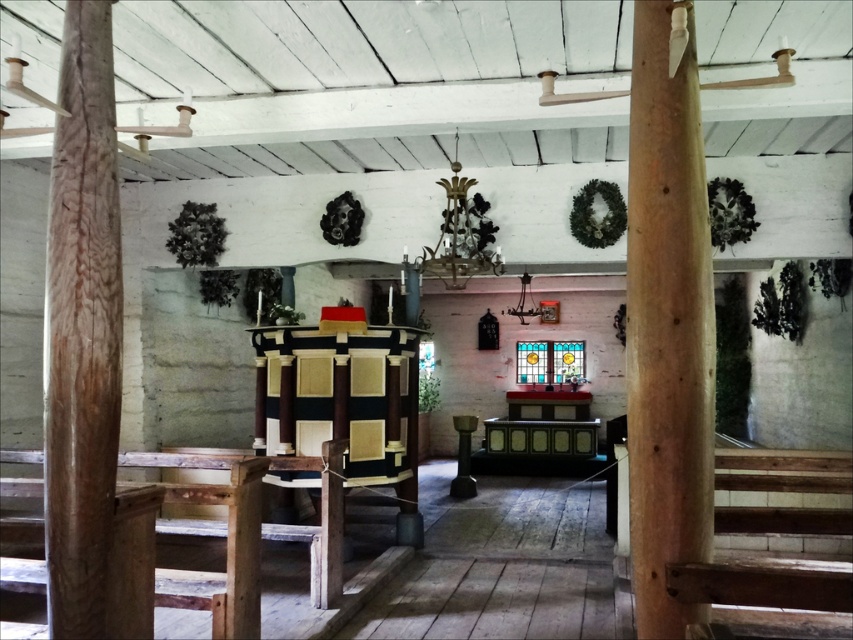
You are standing in the center of the church and want to move towards the altar. There is a point marked at coordinates (666, 326) on a smooth light brown wooden pillar at center. If you walk straight towards the altar, will you pass by this point?

The point marked at coordinates (666, 326) is on the smooth light brown wooden pillar at center. Since the pillar is in the center of the church and you are also starting from the center, walking straight towards the altar would not require passing by the pillar. Therefore, you will not pass by this point.

You are standing at the entrance of the rustic wooden church and want to walk towards the large ornate organ in the center. As you walk, you notice two pillars. Which pillar will you see first as you approach the organ? The smooth light brown wooden pillar at center or the brown wood pillar at left?

→ The smooth light brown wooden pillar at center is in front of the brown wood pillar at left, so you will see the smooth light brown wooden pillar at center first as you approach the organ.

You are an architect inspecting the structure of the church. You notice two pillars, the smooth light brown wooden pillar at center and the brown wood pillar at left. Which pillar is positioned higher in the church?

The smooth light brown wooden pillar at center is positioned higher than the brown wood pillar at left because it is above it.